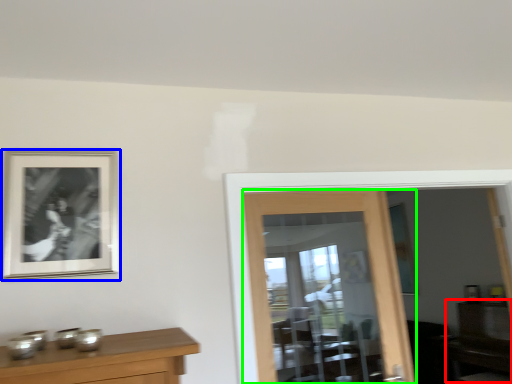
Question: Estimate the real-world distances between objects in this image. Which object is closer to dresser (highlighted by a red box), picture frame (highlighted by a blue box) or door (highlighted by a green box)?

Choices:
 (A) picture frame
 (B) door

Answer: (B)